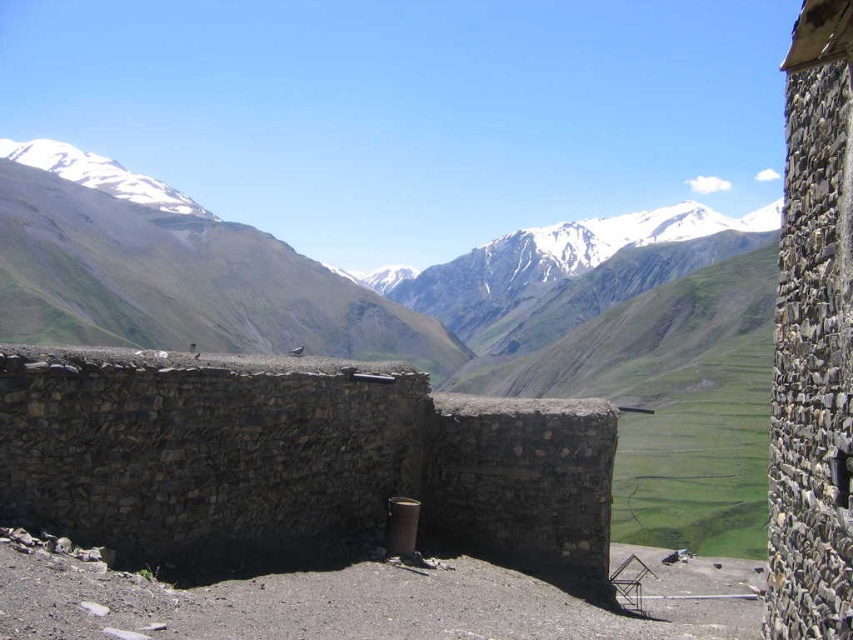
Which is behind, point (592, 435) or point (259, 285)?

Positioned behind is point (259, 285).

The width and height of the screenshot is (853, 640). I want to click on gray stone wall at center, so click(294, 454).

Is point (28, 461) positioned before point (445, 364)?

Yes, point (28, 461) is closer to viewer.

Locate an element on the screen. This screenshot has height=640, width=853. gray stone wall at center is located at coordinates (294, 454).

Which of these two, green grassy mountain at upper center or snowy rock mountain at center, stands shorter?

snowy rock mountain at center is shorter.

Does point (115, 180) come closer to viewer compared to point (677, 230)?

Yes, point (115, 180) is in front of point (677, 230).

Between point (219, 237) and point (421, 275), which one is positioned behind?

Positioned behind is point (421, 275).

Locate an element on the screen. This screenshot has height=640, width=853. green grassy mountain at upper center is located at coordinates pyautogui.click(x=175, y=272).

Which is above, gray stone wall at center or snowy rock mountain at center?

snowy rock mountain at center is higher up.

Which is behind, point (479, 412) or point (498, 307)?

The point (498, 307) is more distant.

This screenshot has height=640, width=853. I want to click on gray stone wall at center, so click(294, 454).